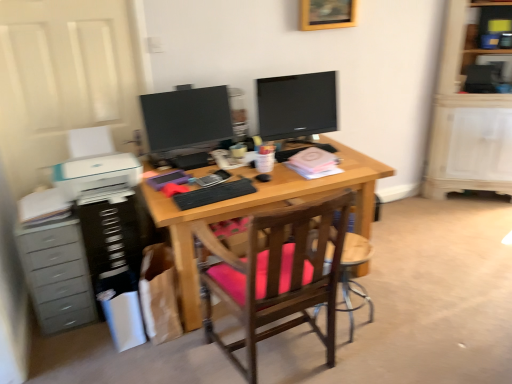
The width and height of the screenshot is (512, 384). Describe the element at coordinates (81, 259) in the screenshot. I see `black plastic dresser at left` at that location.

What do you see at coordinates (186, 117) in the screenshot? I see `matte black monitor at center, which ranks as the 2th television in right-to-left order` at bounding box center [186, 117].

Consider the image. In order to face gray plastic chest of drawers at left, should I rotate leftwards or rightwards?

Rotate your view left by about 25.392°.

Measure the distance between matte black monitor at center, marked as the 1th television in a right-to-left arrangement, and camera.

matte black monitor at center, marked as the 1th television in a right-to-left arrangement, and camera are 2.62 meters apart.

The height and width of the screenshot is (384, 512). What are the coordinates of `wooden chair with pink cushion at center` in the screenshot? It's located at (276, 274).

Between point (87, 314) and point (203, 115), which one is positioned behind?

The point (203, 115) is farther.

Which of these two, gray plastic chest of drawers at left or matte black monitor at center, which ranks as the 2th television in right-to-left order, stands shorter?

Standing shorter between the two is matte black monitor at center, which ranks as the 2th television in right-to-left order.

Between gray plastic chest of drawers at left and matte black monitor at center, arranged as the 1th television when viewed from the left, which one has larger width?

gray plastic chest of drawers at left is wider.

From the image's perspective, which is above, gray plastic chest of drawers at left or matte black monitor at center, arranged as the 1th television when viewed from the left?

matte black monitor at center, arranged as the 1th television when viewed from the left, from the image's perspective.

From a real-world perspective, between black plastic dresser at left and wooden chair at center, who is vertically lower?

wooden chair at center.

Consider the image. Is black plastic dresser at left outside of wooden chair at center?

Yes, black plastic dresser at left is outside of wooden chair at center.

Considering the sizes of objects black plastic dresser at left and wooden chair at center in the image provided, who is bigger, black plastic dresser at left or wooden chair at center?

With larger size is black plastic dresser at left.

At what (x,y) coordinates should I click in order to perform the action: click on dresser on the left of the wooden chair at center. Please return your answer as a coordinate pair (x, y). This screenshot has height=384, width=512. Looking at the image, I should click on (81, 259).

From a real-world perspective, which object stands above the other?

From a 3D spatial view, gray plastic chest of drawers at left is above.

Measure the distance from wooden chair at center to gray plastic chest of drawers at left.

wooden chair at center and gray plastic chest of drawers at left are 4.54 feet apart from each other.

The height and width of the screenshot is (384, 512). Find the location of `computer chair below the gray plastic chest of drawers at left (from a real-world perspective)`. computer chair below the gray plastic chest of drawers at left (from a real-world perspective) is located at coordinates (352, 280).

Is there a large distance between wooden chair at center and gray plastic chest of drawers at left?

Yes, wooden chair at center and gray plastic chest of drawers at left are quite far apart.

Considering the relative sizes of wooden picture frame at upper center and matte black monitor at center, the 2th television when ordered from left to right, in the image provided, is wooden picture frame at upper center wider than matte black monitor at center, the 2th television when ordered from left to right,?

No.

From the image's perspective, would you say wooden picture frame at upper center is positioned over matte black monitor at center, marked as the 1th television in a right-to-left arrangement?

Indeed, from the image's perspective, wooden picture frame at upper center is shown above matte black monitor at center, marked as the 1th television in a right-to-left arrangement.

You are a GUI agent. You are given a task and a screenshot of the screen. Output one action in this format:
    pyautogui.click(x=<x>, y=<y>)
    Task: Click on the picture frame above the matte black monitor at center, marked as the 1th television in a right-to-left arrangement (from a real-world perspective)
    This screenshot has height=384, width=512.
    Given the screenshot: What is the action you would take?
    pyautogui.click(x=326, y=14)

How many degrees apart are the facing directions of wooden picture frame at upper center and matte black monitor at center, marked as the 1th television in a right-to-left arrangement?

They differ by 5.28 degrees in their facing directions.

Does black matte keyboard at center lie behind wooden chair with pink cushion at center?

Yes, black matte keyboard at center is further from the viewer.

Between black matte keyboard at center and wooden chair with pink cushion at center, which one has smaller size?

black matte keyboard at center.

From the image's perspective, is black matte keyboard at center under black plastic dresser at left?

Incorrect, from the image's perspective, black matte keyboard at center is higher than black plastic dresser at left.

Do you think black matte keyboard at center is within black plastic dresser at left, or outside of it?

black matte keyboard at center is outside black plastic dresser at left.

Is black matte keyboard at center next to black plastic dresser at left?

There is a gap between black matte keyboard at center and black plastic dresser at left.

In the scene shown: Which of these two, black matte keyboard at center or black plastic dresser at left, is wider?

With larger width is black plastic dresser at left.

Considering the relative positions of wooden chair with pink cushion at center and wooden chair at center in the image provided, is wooden chair with pink cushion at center to the left or to the right of wooden chair at center?

In the image, wooden chair with pink cushion at center appears on the left side of wooden chair at center.

From the image's perspective, is wooden chair with pink cushion at center over wooden chair at center?

Yes, from the image's perspective, wooden chair with pink cushion at center is above wooden chair at center.

Consider the image. Which is closer, (x=259, y=309) or (x=359, y=294)?

The point (x=259, y=309) is more forward.

Is wooden chair with pink cushion at center oriented towards wooden chair at center?

No.

This screenshot has height=384, width=512. Identify the location of chest of drawers in front of the matte black monitor at center, arranged as the 1th television when viewed from the left. (57, 274).

Identify the location of computer chair below the black plastic dresser at left (from a real-world perspective). (352, 280).

When comparing their distances from black matte keyboard at center, does matte black monitor at center, marked as the 1th television in a right-to-left arrangement, or matte black monitor at center, arranged as the 1th television when viewed from the left, seem closer?

matte black monitor at center, arranged as the 1th television when viewed from the left.

Estimate the real-world distances between objects in this image. Which object is further from black matte keyboard at center, wooden picture frame at upper center or matte black monitor at center, arranged as the 1th television when viewed from the left?

Based on the image, wooden picture frame at upper center appears to be further to black matte keyboard at center.

Considering their positions, is wooden chair with pink cushion at center positioned further to wooden picture frame at upper center than black matte keyboard at center?

Among the two, wooden chair with pink cushion at center is located further to wooden picture frame at upper center.

Based on their spatial positions, is black matte keyboard at center or matte black monitor at center, marked as the 1th television in a right-to-left arrangement, closer to black plastic dresser at left?

black matte keyboard at center is closer to black plastic dresser at left.

Looking at the image, which one is located closer to wooden chair at center, wooden picture frame at upper center or gray plastic chest of drawers at left?

The object closer to wooden chair at center is gray plastic chest of drawers at left.

Estimate the real-world distances between objects in this image. Which object is further from gray plastic chest of drawers at left, wooden chair with pink cushion at center or wooden picture frame at upper center?

wooden picture frame at upper center lies further to gray plastic chest of drawers at left than the other object.

Based on their spatial positions, is matte black monitor at center, marked as the 1th television in a right-to-left arrangement, or gray plastic chest of drawers at left further from wooden shelf at upper right?

gray plastic chest of drawers at left is further to wooden shelf at upper right.

Based on their spatial positions, is wooden picture frame at upper center or wooden chair at center closer to matte black monitor at center, the 2th television when ordered from left to right?

wooden picture frame at upper center.

The image size is (512, 384). I want to click on television between gray plastic chest of drawers at left and wooden chair with pink cushion at center from left to right, so click(x=186, y=117).

Locate an element on the screen. computer chair between black plastic dresser at left and wooden shelf at upper right from left to right is located at coordinates (352, 280).

What are the coordinates of `television between black plastic dresser at left and matte black monitor at center, marked as the 1th television in a right-to-left arrangement, from left to right` in the screenshot? It's located at (186, 117).

Where is `computer chair situated between gray plastic chest of drawers at left and wooden shelf at upper right from left to right`? computer chair situated between gray plastic chest of drawers at left and wooden shelf at upper right from left to right is located at coordinates (352, 280).